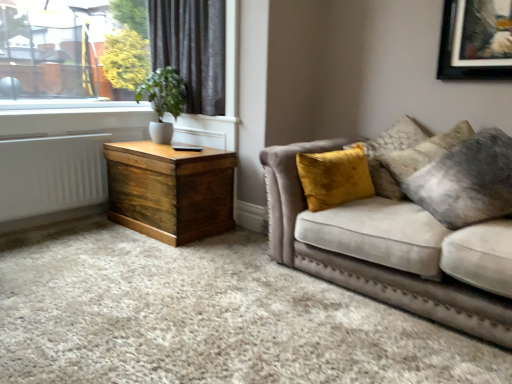
This screenshot has width=512, height=384. What are the coordinates of `free point below white painted radiator at left (from a real-world perspective)` in the screenshot? It's located at (60, 220).